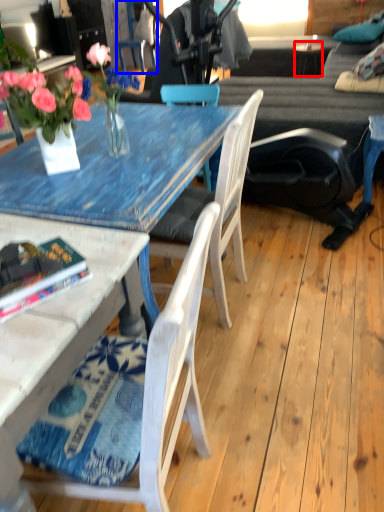
Question: Which of the following is the farthest to the observer, side table (highlighted by a red box) or chair (highlighted by a blue box)?

Choices:
 (A) side table
 (B) chair

Answer: (B)